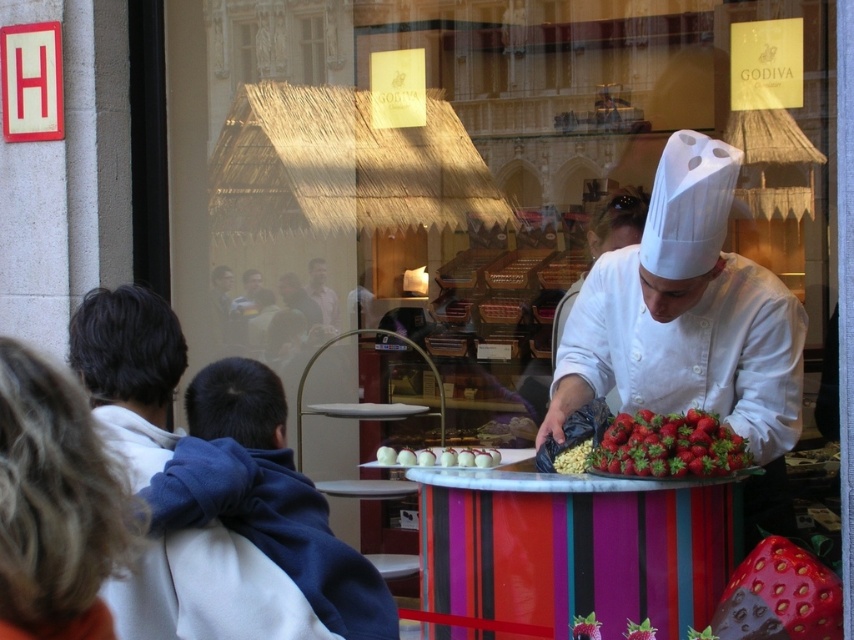
Is point (732, 573) farther from camera compared to point (699, 444)?

Yes, point (732, 573) is farther from viewer.

Does shiny chocolate strawberry at center appear under red matte strawberries at center?

Indeed, shiny chocolate strawberry at center is positioned under red matte strawberries at center.

Between point (828, 595) and point (732, 435), which one is positioned in front?

Positioned in front is point (828, 595).

Find the location of `shiny chocolate strawberry at center`. shiny chocolate strawberry at center is located at coordinates (779, 596).

Between white chef hat at center and smooth skin face at center, which one is positioned higher?

smooth skin face at center is above.

Is point (759, 422) more distant than point (325, 300)?

No, it is not.

Is point (646, 324) positioned after point (313, 280)?

No, (646, 324) is closer to viewer.

You are a GUI agent. You are given a task and a screenshot of the screen. Output one action in this format:
    pyautogui.click(x=<x>, y=<y>)
    Task: Click on the white chef hat at center
    The height and width of the screenshot is (640, 854).
    Given the screenshot: What is the action you would take?
    pyautogui.click(x=689, y=324)

Which of these two, shiny chocolate strawberry at center or white glossy chocolate at center, stands taller?

shiny chocolate strawberry at center is taller.

At what (x,y) coordinates should I click in order to perform the action: click on shiny chocolate strawberry at center. Please return your answer as a coordinate pair (x, y). Looking at the image, I should click on (779, 596).

The width and height of the screenshot is (854, 640). Find the location of `shiny chocolate strawberry at center`. shiny chocolate strawberry at center is located at coordinates (779, 596).